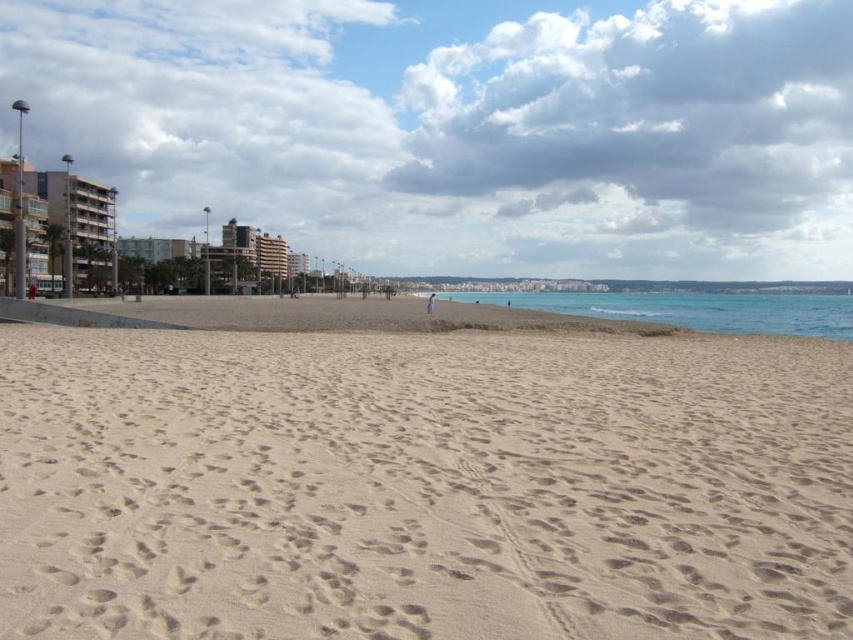
Between light beige sand at center and blue water at lower right, which one is positioned higher?

Positioned higher is blue water at lower right.

Which is in front, point (6, 592) or point (706, 292)?

Point (6, 592) is in front.

In order to click on light beige sand at center in this screenshot , I will do `click(422, 484)`.

Between point (672, 316) and point (96, 276), which one is positioned behind?

Point (96, 276)

Can you confirm if blue water at lower right is taller than green glass building at left?

In fact, blue water at lower right may be shorter than green glass building at left.

Which is behind, point (790, 317) or point (115, 236)?

The point (115, 236) is behind.

At what (x,y) coordinates should I click in order to perform the action: click on blue water at lower right. Please return your answer as a coordinate pair (x, y). This screenshot has height=640, width=853. Looking at the image, I should click on (692, 308).

Can you confirm if light beige sand at center is smaller than green glass building at left?

Correct, light beige sand at center occupies less space than green glass building at left.

Image resolution: width=853 pixels, height=640 pixels. Describe the element at coordinates (422, 484) in the screenshot. I see `light beige sand at center` at that location.

Locate an element on the screen. Image resolution: width=853 pixels, height=640 pixels. light beige sand at center is located at coordinates (422, 484).